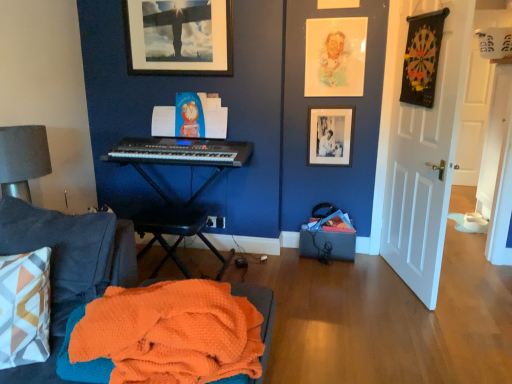
Question: Should I look upward or downward to see matte black picture frame at upper center, which is the first picture frame from left to right?

Choices:
 (A) up
 (B) down

Answer: (A)

Question: Does black plastic music stool at center have a greater width compared to orange waffle knit blanket at lower left?

Choices:
 (A) no
 (B) yes

Answer: (A)

Question: Is black plastic music stool at center not close to orange waffle knit blanket at lower left?

Choices:
 (A) no
 (B) yes

Answer: (B)

Question: Can you confirm if black plastic music stool at center is bigger than orange waffle knit blanket at lower left?

Choices:
 (A) no
 (B) yes

Answer: (B)

Question: Does black plastic music stool at center appear on the right side of orange waffle knit blanket at lower left?

Choices:
 (A) yes
 (B) no

Answer: (B)

Question: From the image's perspective, is black plastic music stool at center beneath orange waffle knit blanket at lower left?

Choices:
 (A) yes
 (B) no

Answer: (B)

Question: Can you confirm if black plastic music stool at center is shorter than orange waffle knit blanket at lower left?

Choices:
 (A) no
 (B) yes

Answer: (A)

Question: From the image's perspective, is orange waffle knit blanket at lower left on top of black matte picture frame at upper right, the first picture frame when ordered from bottom to top?

Choices:
 (A) no
 (B) yes

Answer: (A)

Question: Is the position of orange waffle knit blanket at lower left less distant than that of black matte picture frame at upper right, the first picture frame when ordered from bottom to top?

Choices:
 (A) no
 (B) yes

Answer: (B)

Question: Is orange waffle knit blanket at lower left oriented away from black matte picture frame at upper right, the second picture frame viewed from the left?

Choices:
 (A) no
 (B) yes

Answer: (A)

Question: Considering the relative sizes of orange waffle knit blanket at lower left and black matte picture frame at upper right, which is the 1th picture frame in right-to-left order, in the image provided, is orange waffle knit blanket at lower left smaller than black matte picture frame at upper right, which is the 1th picture frame in right-to-left order,?

Choices:
 (A) no
 (B) yes

Answer: (A)

Question: Is orange waffle knit blanket at lower left placed right next to black matte picture frame at upper right, the second picture frame viewed from the left?

Choices:
 (A) yes
 (B) no

Answer: (B)

Question: Is orange waffle knit blanket at lower left wider than black matte picture frame at upper right, arranged as the 2th picture frame when viewed from the top?

Choices:
 (A) yes
 (B) no

Answer: (A)

Question: Is orange waffle knit blanket at lower left closer to the viewer compared to white matte door at right?

Choices:
 (A) yes
 (B) no

Answer: (A)